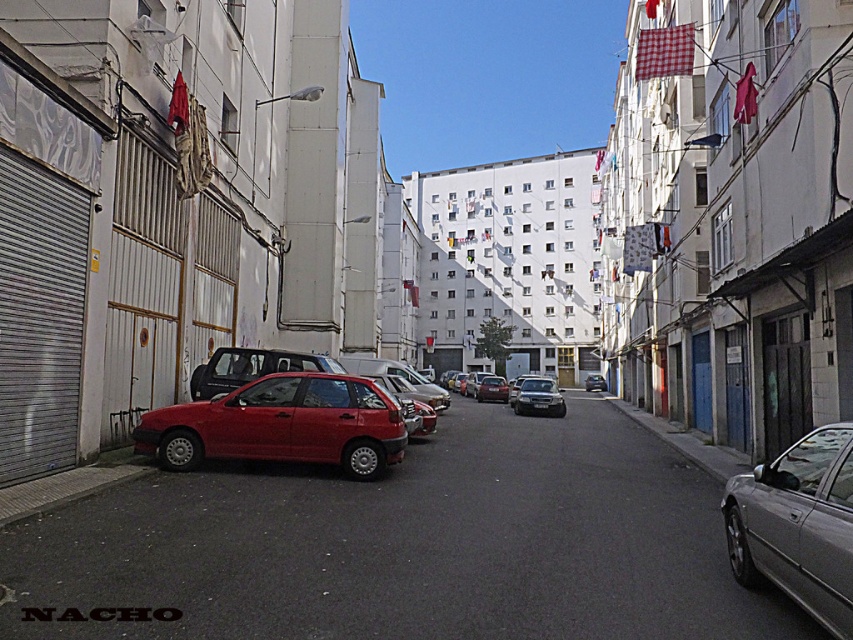
Which is more to the right, silver metallic sedan at right or black plastic license plate at center?

Positioned to the right is black plastic license plate at center.

Between point (817, 621) and point (537, 404), which one is positioned in front?

Point (817, 621)

Image resolution: width=853 pixels, height=640 pixels. In order to click on silver metallic sedan at right in this screenshot , I will do `click(798, 525)`.

Which is in front, point (759, 556) or point (508, 390)?

Point (759, 556)

This screenshot has height=640, width=853. In order to click on silver metallic sedan at right in this screenshot , I will do `click(798, 525)`.

Consider the image. Can you confirm if matte red hatchback at center is positioned to the left of metallic silver sedan at center?

Indeed, matte red hatchback at center is positioned on the left side of metallic silver sedan at center.

Can you confirm if matte red hatchback at center is positioned above metallic silver sedan at center?

Indeed, matte red hatchback at center is positioned over metallic silver sedan at center.

Where is `matte red hatchback at center`? matte red hatchback at center is located at coordinates (281, 426).